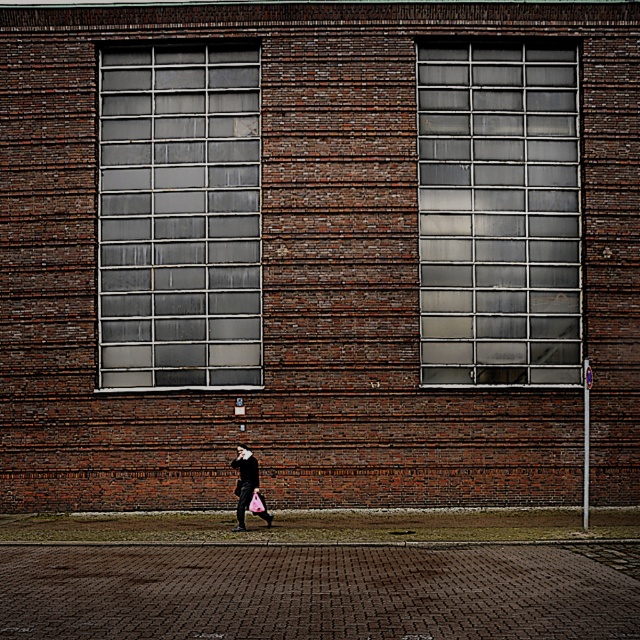
Question: Which object is closer to the camera taking this photo?

Choices:
 (A) brick pavement at lower center
 (B) black matte coat at center

Answer: (A)

Question: Is brick pavement at lower center thinner than black matte coat at center?

Choices:
 (A) no
 (B) yes

Answer: (A)

Question: Which point appears farthest from the camera in this image?

Choices:
 (A) (3, 554)
 (B) (257, 480)

Answer: (B)

Question: In this image, where is brick pavement at lower center located relative to black matte coat at center?

Choices:
 (A) left
 (B) right

Answer: (B)

Question: Among these objects, which one is farthest from the camera?

Choices:
 (A) black matte coat at center
 (B) brick pavement at lower center

Answer: (A)

Question: Is brick pavement at lower center thinner than black matte coat at center?

Choices:
 (A) no
 (B) yes

Answer: (A)